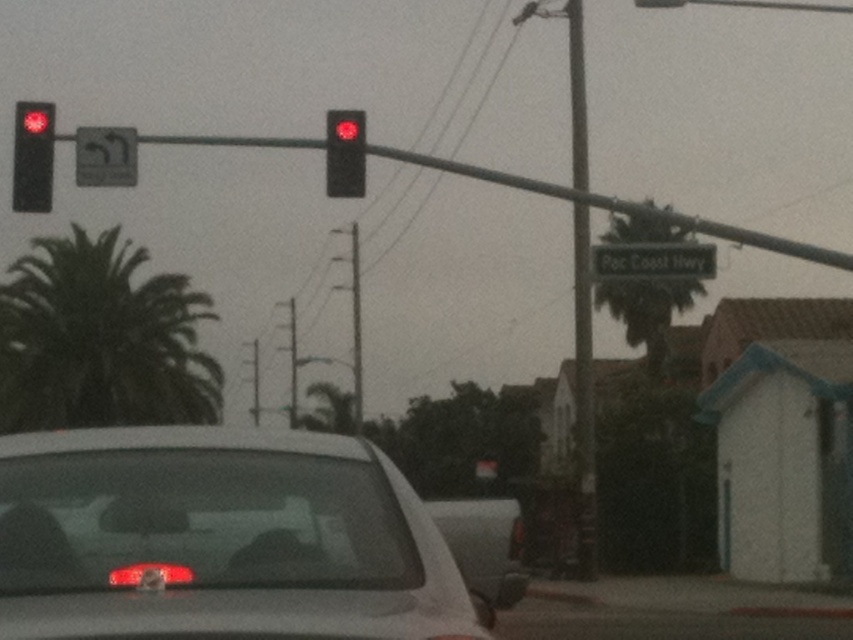
Question: Which point is farther from the camera taking this photo?

Choices:
 (A) (120, 326)
 (B) (361, 548)

Answer: (A)

Question: Considering the real-world distances, which object is farthest from the satin white sedan at center?

Choices:
 (A) red matte traffic light at upper center
 (B) white plastic street sign at upper center
 (C) white matte car at center
 (D) metallic reflective arrow at upper left

Answer: (B)

Question: Is metallic pole at center positioned in front of metallic reflective arrow at upper left?

Choices:
 (A) no
 (B) yes

Answer: (B)

Question: Which point is closer to the camera?

Choices:
 (A) satin white sedan at center
 (B) metallic pole at center

Answer: (A)

Question: Does satin white sedan at center have a greater width compared to white plastic street sign at upper center?

Choices:
 (A) no
 (B) yes

Answer: (B)

Question: From the image, what is the correct spatial relationship of metallic pole at center in relation to metallic reflective arrow at upper left?

Choices:
 (A) below
 (B) above

Answer: (B)